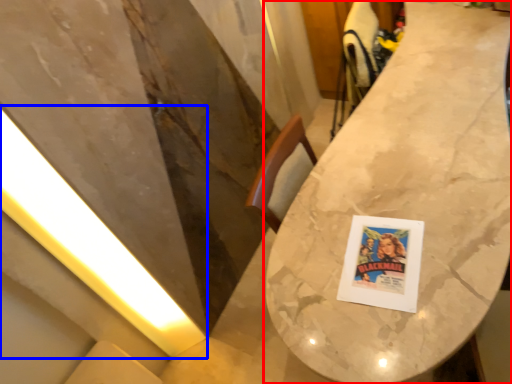
Question: Among these objects, which one is farthest to the camera, table (highlighted by a red box) or light (highlighted by a blue box)?

Choices:
 (A) table
 (B) light

Answer: (B)